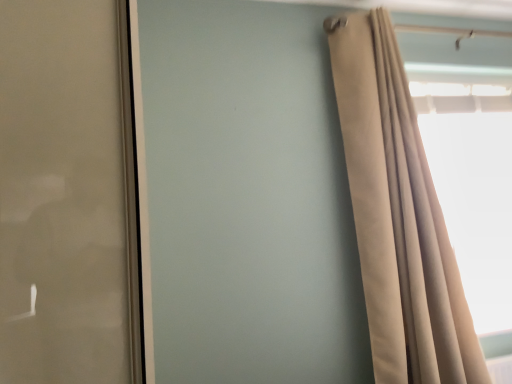
Describe the element at coordinates (398, 215) in the screenshot. I see `beige fabric curtain at right` at that location.

This screenshot has width=512, height=384. What are the coordinates of `beige fabric curtain at right` in the screenshot? It's located at (398, 215).

Measure the distance between beige fabric curtain at right and camera.

The distance of beige fabric curtain at right from camera is 1.58 meters.

You are a GUI agent. You are given a task and a screenshot of the screen. Output one action in this format:
    pyautogui.click(x=<x>, y=<y>)
    Task: Click on the beige fabric curtain at right
    Image resolution: width=512 pixels, height=384 pixels.
    Given the screenshot: What is the action you would take?
    pyautogui.click(x=398, y=215)